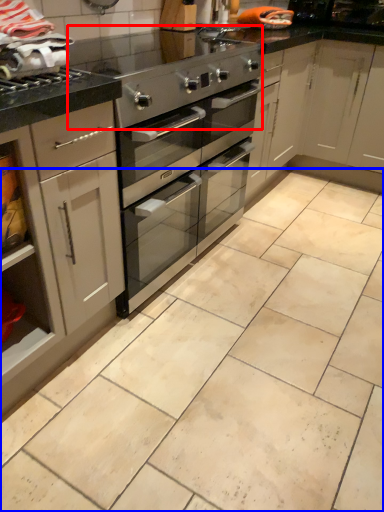
Question: Which of the following is the closest to the observer, appliance (highlighted by a red box) or counter (highlighted by a blue box)?

Choices:
 (A) appliance
 (B) counter

Answer: (B)